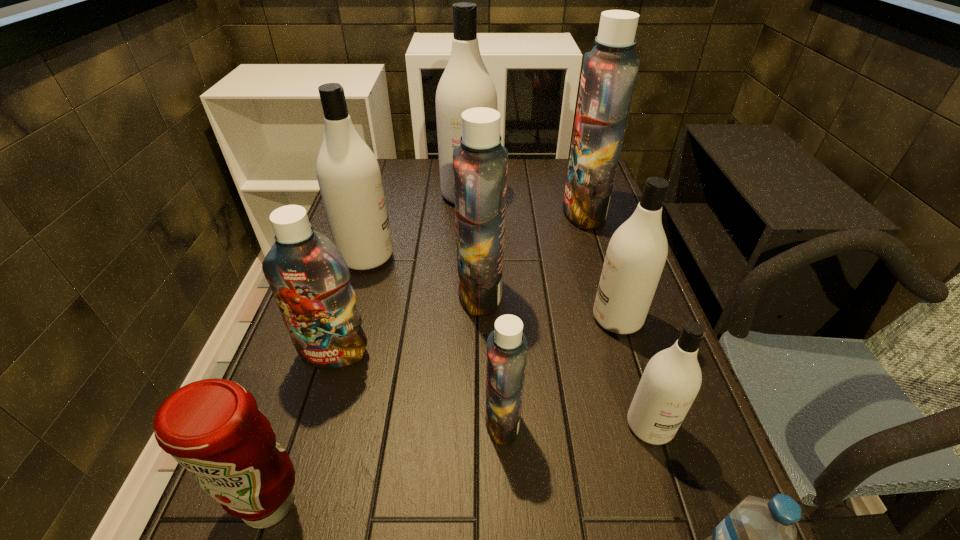
Image resolution: width=960 pixels, height=540 pixels. In order to click on vacant space located on the front label of the second farthest blue shampoo in this screenshot , I will do `click(329, 293)`.

Find the location of a particular element. vacant area situated on the front label of the second farthest blue shampoo is located at coordinates (414, 293).

Locate an element on the screen. Image resolution: width=960 pixels, height=540 pixels. free space located on the front-facing side of the second nearest white shampoo is located at coordinates (433, 319).

You are a GUI agent. You are given a task and a screenshot of the screen. Output one action in this format:
    pyautogui.click(x=<x>, y=<y>)
    Task: Click on the free space located on the front-facing side of the second nearest white shampoo
    This screenshot has height=540, width=960.
    Given the screenshot: What is the action you would take?
    pyautogui.click(x=438, y=319)

What are the coordinates of `vacant space situated on the front-facing side of the second nearest white shampoo` in the screenshot? It's located at (468, 319).

Locate an element on the screen. Image resolution: width=960 pixels, height=540 pixels. free spot located on the front label of the third nearest shampoo is located at coordinates (316, 413).

The height and width of the screenshot is (540, 960). Find the location of `vacant space located 0.290m on the back of the condiment`. vacant space located 0.290m on the back of the condiment is located at coordinates (324, 341).

Locate an element on the screen. The height and width of the screenshot is (540, 960). free region located on the front label of the nearest blue shampoo is located at coordinates (380, 421).

Where is `blank area located 0.310m on the front label of the nearest blue shampoo`? The image size is (960, 540). blank area located 0.310m on the front label of the nearest blue shampoo is located at coordinates (322, 421).

The height and width of the screenshot is (540, 960). In order to click on vacant space located on the front label of the nearest blue shampoo in this screenshot , I will do `click(438, 421)`.